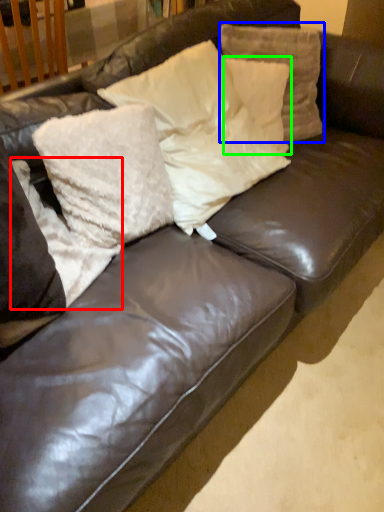
Question: Based on their relative distances, which object is farther from pillow (highlighted by a red box)? Choose from pillow (highlighted by a blue box) and pillow (highlighted by a green box).

Choices:
 (A) pillow
 (B) pillow

Answer: (A)